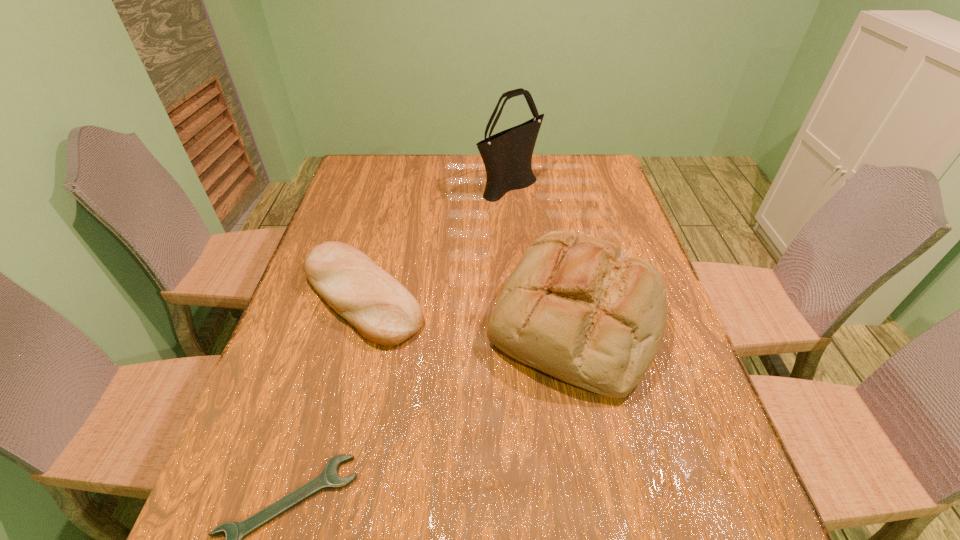
The height and width of the screenshot is (540, 960). Identify the location of shoulder bag. (507, 156).

Identify the location of the tallest object. The height and width of the screenshot is (540, 960). point(507,156).

You are a GUI agent. You are given a task and a screenshot of the screen. Output one action in this format:
    pyautogui.click(x=<x>, y=<y>)
    Task: Click on the second tallest object
    
    Given the screenshot: What is the action you would take?
    pyautogui.click(x=576, y=307)

You are a GUI agent. You are given a task and a screenshot of the screen. Output one action in this format:
    pyautogui.click(x=<x>, y=<y>)
    Task: Click on the right bread
    
    Given the screenshot: What is the action you would take?
    pyautogui.click(x=576, y=307)

I want to click on the left bread, so coord(384,312).

Locate an element on the screen. The image size is (960, 540). the shorter bread is located at coordinates (384, 312).

At what (x,y) coordinates should I click in order to perform the action: click on free location located 0.140m on the left of the farthest object. Please return your answer as a coordinate pair (x, y). Looking at the image, I should click on (436, 185).

Locate an element on the screen. vacant space located on the left of the second tallest object is located at coordinates [x=342, y=318].

At what (x,y) coordinates should I click in order to perform the action: click on free space located 0.370m on the right of the left bread. Please return your answer as a coordinate pair (x, y). Looking at the image, I should click on (572, 296).

Find the location of `object positioned at the far edge`. object positioned at the far edge is located at coordinates (507, 156).